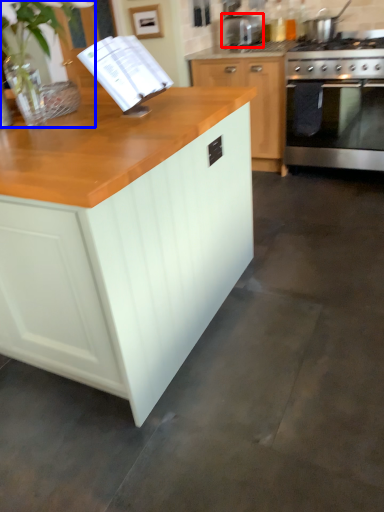
Question: Which object appears farthest to the camera in this image, appliance (highlighted by a red box) or plant (highlighted by a blue box)?

Choices:
 (A) appliance
 (B) plant

Answer: (A)